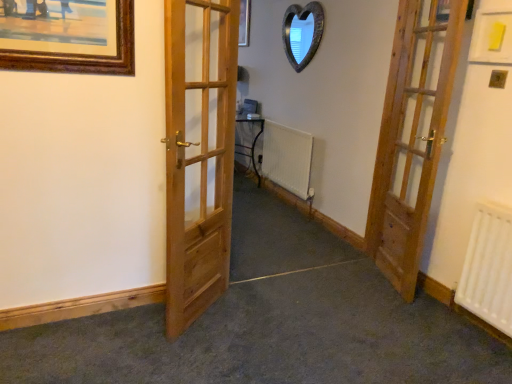
This screenshot has width=512, height=384. I want to click on white matte radiator at lower right, the 2th radiator positioned from the top, so click(x=489, y=267).

Describe the element at coordinates (489, 267) in the screenshot. I see `white matte radiator at lower right, the 2th radiator positioned from the top` at that location.

This screenshot has width=512, height=384. I want to click on wooden door at right, positioned as the second door in left-to-right order, so coord(412,135).

The image size is (512, 384). Describe the element at coordinates (412, 135) in the screenshot. I see `wooden door at right, which ranks as the 1th door in right-to-left order` at that location.

What do you see at coordinates (198, 153) in the screenshot? I see `natural wood door at center, acting as the second door starting from the right` at bounding box center [198, 153].

Describe the element at coordinates (287, 158) in the screenshot. I see `white matte radiator at center, acting as the 2th radiator starting from the bottom` at that location.

The image size is (512, 384). Find the location of `wooden heart-shaped mirror at upper center`. wooden heart-shaped mirror at upper center is located at coordinates (302, 33).

You are a GUI agent. You are given a task and a screenshot of the screen. Output one action in this format:
    pyautogui.click(x=<x>, y=<y>)
    Task: Click on the white matte radiator at lower right, placed as the first radiator when sorted from bottom to top
    
    Given the screenshot: What is the action you would take?
    pyautogui.click(x=489, y=267)

From a real-world perspective, relative to natural wood door at center, acting as the second door starting from the right, is wooden door at right, positioned as the second door in left-to-right order, vertically above or below?

wooden door at right, positioned as the second door in left-to-right order, is above natural wood door at center, acting as the second door starting from the right.

What are the coordinates of `door in front of the wooden door at right, which ranks as the 1th door in right-to-left order` in the screenshot? It's located at (198, 153).

Is wooden door at right, which ranks as the 1th door in right-to-left order, situated inside natural wood door at center, acting as the second door starting from the right, or outside?

wooden door at right, which ranks as the 1th door in right-to-left order, lies outside natural wood door at center, acting as the second door starting from the right.

From the image's perspective, is wooden door at right, which ranks as the 1th door in right-to-left order, located above or below natural wood door at center, acting as the second door starting from the right?

Based on their image positions, wooden door at right, which ranks as the 1th door in right-to-left order, is located above natural wood door at center, acting as the second door starting from the right.

Which is farther, (206, 284) or (483, 253)?

Point (206, 284)

Can you confirm if natural wood door at center, acting as the second door starting from the right, is wider than white matte radiator at lower right, which is the second radiator from back to front?

Yes, natural wood door at center, acting as the second door starting from the right, is wider than white matte radiator at lower right, which is the second radiator from back to front.

From a real-world perspective, relative to white matte radiator at lower right, which is the second radiator from back to front, is natural wood door at center, acting as the second door starting from the right, vertically above or below?

natural wood door at center, acting as the second door starting from the right, is situated higher than white matte radiator at lower right, which is the second radiator from back to front, in the real world.

Is natural wood door at center, acting as the second door starting from the right, taller than white matte radiator at lower right, the 2th radiator positioned from the top?

Correct, natural wood door at center, acting as the second door starting from the right, is much taller as white matte radiator at lower right, the 2th radiator positioned from the top.

How distant is white matte radiator at center, which appears as the 1th radiator when viewed from the left, from wooden heart-shaped mirror at upper center?

The distance of white matte radiator at center, which appears as the 1th radiator when viewed from the left, from wooden heart-shaped mirror at upper center is 85.11 centimeters.

Could you tell me if white matte radiator at center, which appears as the 1th radiator when viewed from the left, is turned towards wooden heart-shaped mirror at upper center?

No.

Who is smaller, white matte radiator at center, positioned as the 2th radiator in right-to-left order, or wooden heart-shaped mirror at upper center?

Smaller between the two is wooden heart-shaped mirror at upper center.

Is wooden heart-shaped mirror at upper center completely or partially inside white matte radiator at center, which is the first radiator from top to bottom?

No, wooden heart-shaped mirror at upper center is not a part of white matte radiator at center, which is the first radiator from top to bottom.

There is a white matte radiator at center, which is the first radiator from top to bottom. What are the coordinates of `the 2nd door above it (from a real-world perspective)` in the screenshot? It's located at (412, 135).

From the image's perspective, would you say white matte radiator at center, which appears as the 1th radiator when viewed from the left, is positioned over wooden door at right, which ranks as the 1th door in right-to-left order?

No, from the image's perspective, white matte radiator at center, which appears as the 1th radiator when viewed from the left, is not on top of wooden door at right, which ranks as the 1th door in right-to-left order.

Which is farther from the camera, (x=282, y=168) or (x=457, y=5)?

The point (x=282, y=168) is farther from the camera.

Is natural wood door at center, which is counted as the first door, starting from the left, at the back of white matte radiator at center, arranged as the 1th radiator when viewed from the back?

No, white matte radiator at center, arranged as the 1th radiator when viewed from the back, is not facing away from natural wood door at center, which is counted as the first door, starting from the left.

Which object is thinner, white matte radiator at center, arranged as the 1th radiator when viewed from the back, or natural wood door at center, acting as the second door starting from the right?

Thinner between the two is white matte radiator at center, arranged as the 1th radiator when viewed from the back.

Is point (303, 137) positioned in front of point (193, 156)?

No, (303, 137) is behind (193, 156).

Considering the relative sizes of white matte radiator at lower right, which is the second radiator from back to front, and wooden heart-shaped mirror at upper center in the image provided, is white matte radiator at lower right, which is the second radiator from back to front, bigger than wooden heart-shaped mirror at upper center?

Indeed, white matte radiator at lower right, which is the second radiator from back to front, has a larger size compared to wooden heart-shaped mirror at upper center.

I want to click on radiator that appears in front of the wooden heart-shaped mirror at upper center, so click(x=489, y=267).

Which is farther, [508,228] or [298,57]?

The point [298,57] is farther.

Does white matte radiator at lower right, positioned as the 2th radiator in left-to-right order, have a lesser height compared to wooden heart-shaped mirror at upper center?

No.

Is wooden heart-shaped mirror at upper center to the left of white matte radiator at center, which is the second radiator in front-to-back order, from the viewer's perspective?

Incorrect, wooden heart-shaped mirror at upper center is not on the left side of white matte radiator at center, which is the second radiator in front-to-back order.

Where is `mirror on the right side of white matte radiator at center, which appears as the 1th radiator when viewed from the left`? mirror on the right side of white matte radiator at center, which appears as the 1th radiator when viewed from the left is located at coordinates (302, 33).

Is wooden heart-shaped mirror at upper center taller or shorter than white matte radiator at center, positioned as the 2th radiator in right-to-left order?

wooden heart-shaped mirror at upper center is shorter than white matte radiator at center, positioned as the 2th radiator in right-to-left order.

Would you say white matte radiator at center, which is the first radiator from top to bottom, is part of wooden heart-shaped mirror at upper center's contents?

That's incorrect, white matte radiator at center, which is the first radiator from top to bottom, is not inside wooden heart-shaped mirror at upper center.

You are a GUI agent. You are given a task and a screenshot of the screen. Output one action in this format:
    pyautogui.click(x=<x>, y=<y>)
    Task: Click on the door above the natural wood door at center, acting as the second door starting from the right (from the image's perspective)
    
    Given the screenshot: What is the action you would take?
    pyautogui.click(x=412, y=135)

Image resolution: width=512 pixels, height=384 pixels. Identify the location of door that is the 1st object above the white matte radiator at lower right, the 2th radiator positioned from the top (from a real-world perspective). (198, 153).

Looking at the image, which one is located further to wooden door at right, which ranks as the 1th door in right-to-left order, natural wood door at center, which is counted as the first door, starting from the left, or wooden heart-shaped mirror at upper center?

wooden heart-shaped mirror at upper center is further to wooden door at right, which ranks as the 1th door in right-to-left order.

From the image, which object appears to be farther from wooden heart-shaped mirror at upper center, wooden door at right, positioned as the second door in left-to-right order, or natural wood door at center, acting as the second door starting from the right?

natural wood door at center, acting as the second door starting from the right, lies further to wooden heart-shaped mirror at upper center than the other object.

In the scene shown: When comparing their distances from wooden heart-shaped mirror at upper center, does white matte radiator at lower right, the first radiator positioned from the right, or wooden door at right, positioned as the second door in left-to-right order, seem closer?

The object closer to wooden heart-shaped mirror at upper center is wooden door at right, positioned as the second door in left-to-right order.

Considering their positions, is white matte radiator at center, which is the first radiator from top to bottom, positioned closer to wooden heart-shaped mirror at upper center than wooden door at right, which ranks as the 1th door in right-to-left order?

white matte radiator at center, which is the first radiator from top to bottom, is positioned closer to the anchor wooden heart-shaped mirror at upper center.

When comparing their distances from wooden door at right, which ranks as the 1th door in right-to-left order, does wooden heart-shaped mirror at upper center or white matte radiator at lower right, the first radiator positioned from the right, seem closer?

white matte radiator at lower right, the first radiator positioned from the right, is closer to wooden door at right, which ranks as the 1th door in right-to-left order.

Considering their positions, is wooden door at right, which ranks as the 1th door in right-to-left order, positioned closer to natural wood door at center, which is counted as the first door, starting from the left, than wooden heart-shaped mirror at upper center?

wooden door at right, which ranks as the 1th door in right-to-left order, lies closer to natural wood door at center, which is counted as the first door, starting from the left, than the other object.

Which object lies nearer to the anchor point wooden door at right, which ranks as the 1th door in right-to-left order, white matte radiator at center, which is the second radiator in front-to-back order, or white matte radiator at lower right, the first radiator positioned from the right?

white matte radiator at lower right, the first radiator positioned from the right, is closer to wooden door at right, which ranks as the 1th door in right-to-left order.

Based on their spatial positions, is white matte radiator at lower right, the 2th radiator positioned from the top, or white matte radiator at center, which is the first radiator from top to bottom, closer to wooden door at right, which ranks as the 1th door in right-to-left order?

Based on the image, white matte radiator at lower right, the 2th radiator positioned from the top, appears to be nearer to wooden door at right, which ranks as the 1th door in right-to-left order.

Identify the location of mirror located between white matte radiator at lower right, the 2th radiator positioned from the top, and white matte radiator at center, which appears as the 1th radiator when viewed from the left, in the depth direction. The image size is (512, 384). (302, 33).

Image resolution: width=512 pixels, height=384 pixels. I want to click on door located between natural wood door at center, acting as the second door starting from the right, and white matte radiator at lower right, positioned as the 2th radiator in left-to-right order, in the left-right direction, so click(412, 135).

I want to click on door between natural wood door at center, acting as the second door starting from the right, and white matte radiator at center, acting as the 2th radiator starting from the bottom, in the front-back direction, so click(412, 135).

Identify the location of door between white matte radiator at lower right, the first radiator positioned from the right, and white matte radiator at center, which is the second radiator in front-to-back order, from front to back. (412, 135).